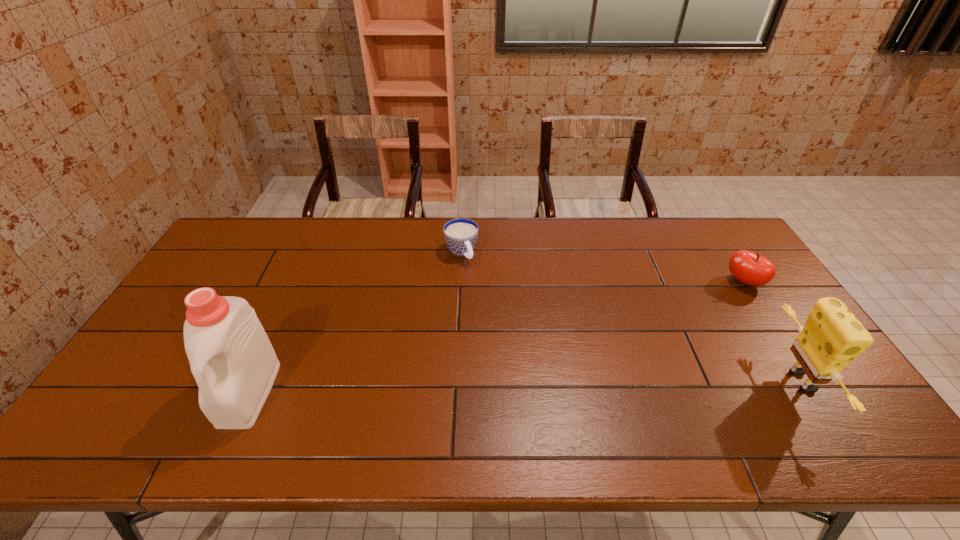
This screenshot has width=960, height=540. In order to click on the leftmost object in this screenshot , I will do `click(231, 357)`.

Identify the location of the tallest object. (231, 357).

Locate an element on the screen. sponge is located at coordinates (832, 337).

I want to click on cup, so click(460, 234).

The height and width of the screenshot is (540, 960). I want to click on the third object from right to left, so click(x=460, y=234).

Find the location of a particular element. the third nearest object is located at coordinates (750, 268).

At what (x,y) coordinates should I click in order to perform the action: click on apple. Please return your answer as a coordinate pair (x, y). Looking at the image, I should click on (750, 268).

This screenshot has height=540, width=960. What are the coordinates of `free space located on the side of the cup with the handle` in the screenshot? It's located at (507, 326).

Where is `free space located on the side of the cup with the handle`? The height and width of the screenshot is (540, 960). free space located on the side of the cup with the handle is located at coordinates (475, 276).

You are a GUI agent. You are given a task and a screenshot of the screen. Output one action in this format:
    pyautogui.click(x=<x>, y=<y>)
    Task: Click on the free space located 0.260m on the side of the cup with the handle
    Image resolution: width=960 pixels, height=540 pixels.
    Given the screenshot: What is the action you would take?
    pyautogui.click(x=502, y=319)